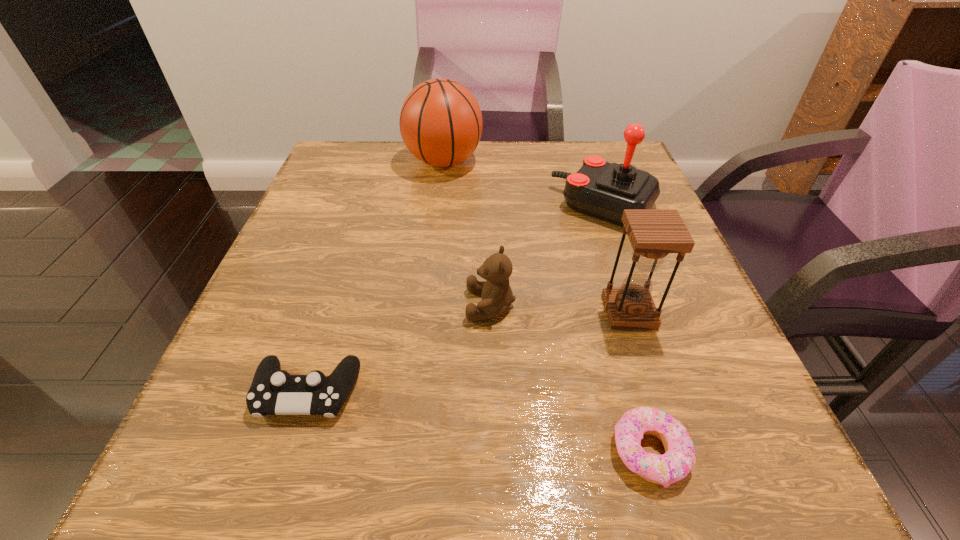
Locate an element on the screen. This screenshot has height=540, width=960. doughnut that is at the right edge is located at coordinates (679, 459).

In order to click on object situated at the far right corner in this screenshot , I will do `click(604, 190)`.

The image size is (960, 540). Find the location of `object at the near right corner`. object at the near right corner is located at coordinates (679, 459).

Image resolution: width=960 pixels, height=540 pixels. What are the coordinates of `blank space at the far edge of the desktop` in the screenshot? It's located at (539, 163).

In the image, there is a desktop. Find the location of `vacant space at the near edge`. vacant space at the near edge is located at coordinates (389, 492).

Where is `vacant position at the left edge of the desktop`? The width and height of the screenshot is (960, 540). vacant position at the left edge of the desktop is located at coordinates (289, 344).

In the image, there is a desktop. Where is `blank space at the right edge`? The width and height of the screenshot is (960, 540). blank space at the right edge is located at coordinates (661, 269).

Find the location of a particular element. The image size is (960, 540). vacant point at the far left corner is located at coordinates (315, 178).

The width and height of the screenshot is (960, 540). In the image, there is a desktop. Find the location of `free space at the near right corner`. free space at the near right corner is located at coordinates (688, 482).

Identify the location of empty space that is in between the basketball and the teddy bear. click(x=468, y=234).